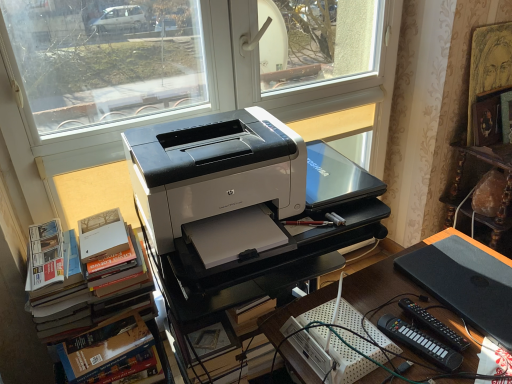
Where is `vacant space that is in between black matte laptop at lower right and black plastic remote control at lower right, which ranks as the 2th equipment in left-to-right order`? vacant space that is in between black matte laptop at lower right and black plastic remote control at lower right, which ranks as the 2th equipment in left-to-right order is located at coordinates (435, 316).